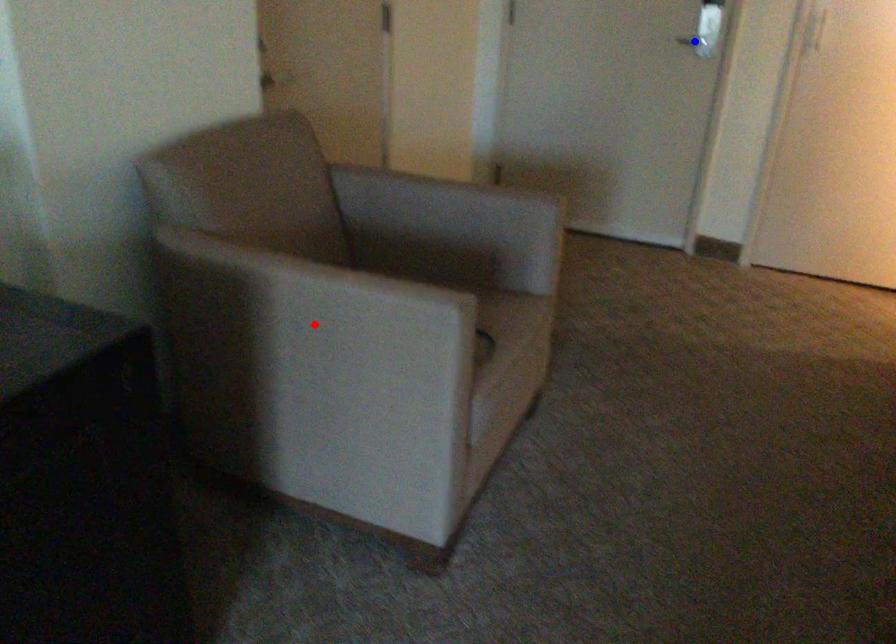
Question: Which of the two points in the image is closer to the camera?

Choices:
 (A) Blue point is closer.
 (B) Red point is closer.

Answer: (B)